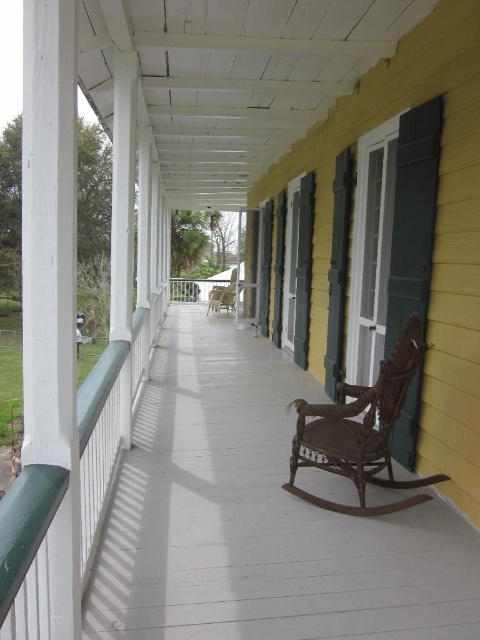
You are planning to place a new table on the white painted wood porch at center. The table is as wide as the wooden rocking chair at center. Will the table fit on the porch if placed in the center?

The white painted wood porch at center might be wider than the wooden rocking chair at center, so the table should fit as long as its width does not exceed the porch width.

You are standing on the white painted wood porch at center and want to walk towards the wooden rocking chair at center. Which direction should you face to move towards it?

Since the white painted wood porch at center is closer to the viewer than the wooden rocking chair at center, you should face away from the viewer to move towards the wooden rocking chair at center.